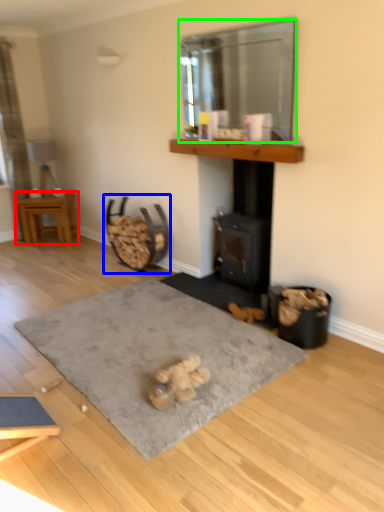
Question: Which is nearer to the table (highlighted by a red box)? rocking chair (highlighted by a blue box) or window screen (highlighted by a green box).

Choices:
 (A) rocking chair
 (B) window screen

Answer: (A)